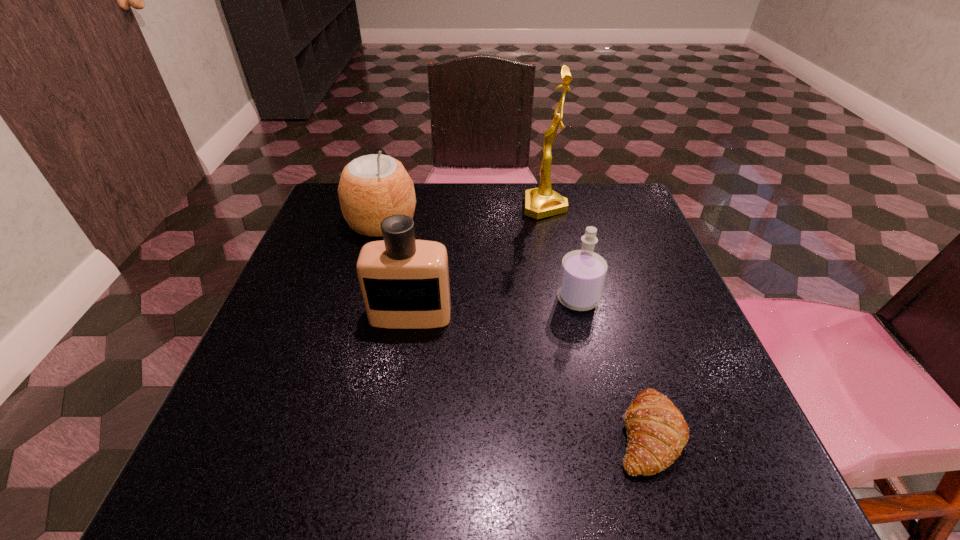
At what (x,y) coordinates should I click in order to perform the action: click on vacant point located between the tallest object and the fourth tallest object. Please return your answer as a coordinate pair (x, y). Looking at the image, I should click on (562, 253).

Identify the location of vacant area that lies between the crescent roll and the award. (596, 320).

At what (x,y) coordinates should I click in order to perform the action: click on vacant region between the second shortest object and the left perfume. Please return your answer as a coordinate pair (x, y). Looking at the image, I should click on (494, 307).

Locate an element on the screen. vacant space that is in between the coconut and the tallest object is located at coordinates (464, 215).

This screenshot has height=540, width=960. I want to click on vacant area between the second shortest object and the shortest object, so (612, 366).

Where is `free area in between the left perfume and the tallest object`? The image size is (960, 540). free area in between the left perfume and the tallest object is located at coordinates (478, 261).

This screenshot has height=540, width=960. In order to click on empty space between the left perfume and the tallest object in this screenshot , I will do `click(478, 261)`.

I want to click on free spot between the tallest object and the coconut, so click(x=464, y=215).

Find the location of a particular element. free space that is in between the shorter perfume and the tallest object is located at coordinates (562, 253).

Locate an element on the screen. This screenshot has height=540, width=960. the fourth closest object to the coconut is located at coordinates 657,433.